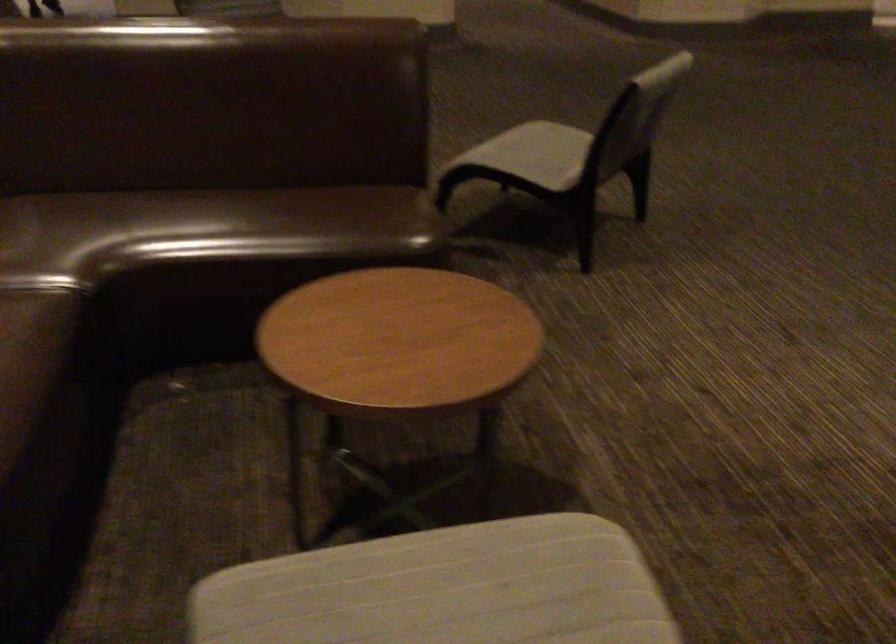
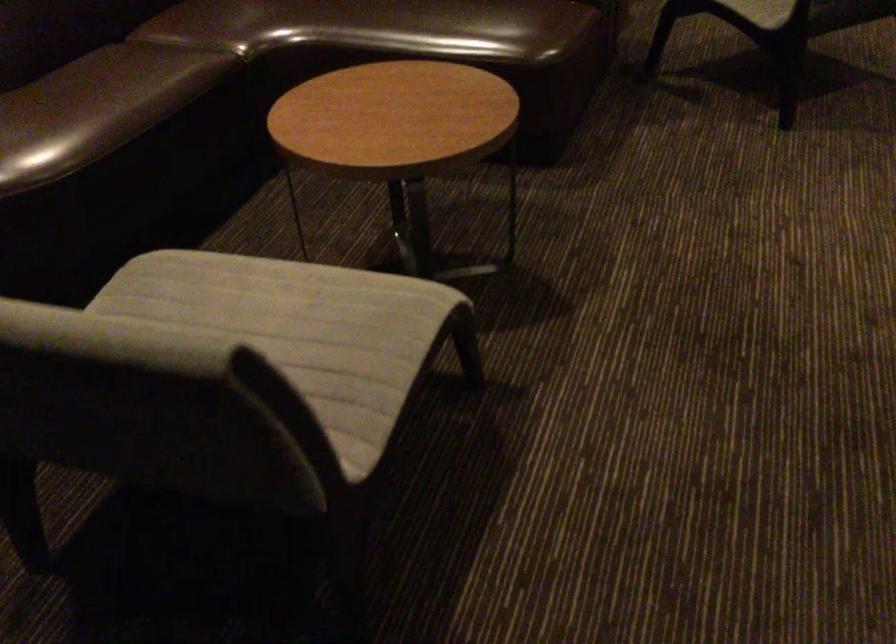
Where in the second image is the point corresponding to point (319, 230) from the first image?

(444, 26)